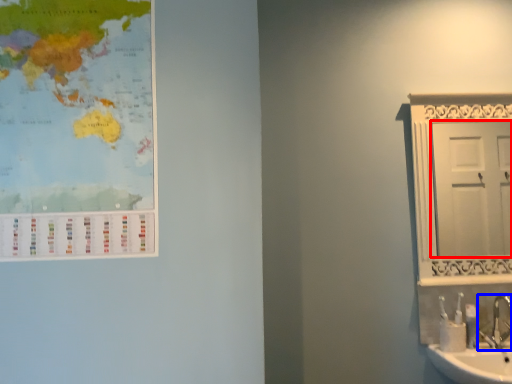
Question: Which of the following is the farthest to the observer, door (highlighted by a red box) or tap (highlighted by a blue box)?

Choices:
 (A) door
 (B) tap

Answer: (A)